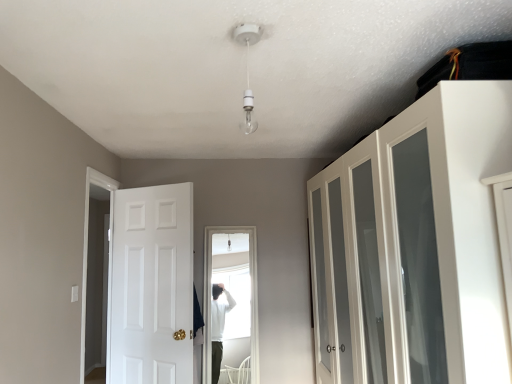
Measure the distance between white glossy door at left and camera.

white glossy door at left is 2.78 meters from camera.

What do you see at coordinates (151, 286) in the screenshot? Image resolution: width=512 pixels, height=384 pixels. I see `white glossy door at left` at bounding box center [151, 286].

Find the location of a particular element. The width and height of the screenshot is (512, 384). white glossy door at left is located at coordinates (151, 286).

What is the approximate width of white glass cabinet at upper right?

The width of white glass cabinet at upper right is 21.11 inches.

You are a GUI agent. You are given a task and a screenshot of the screen. Output one action in this format:
    pyautogui.click(x=<x>, y=<y>)
    Task: Click on the white glass cabinet at upper right
    The height and width of the screenshot is (384, 512).
    Given the screenshot: What is the action you would take?
    pyautogui.click(x=415, y=245)

Describe the element at coordinates (415, 245) in the screenshot. This screenshot has height=384, width=512. I see `white glass cabinet at upper right` at that location.

What are the coordinates of `white glossy door at left` in the screenshot? It's located at (151, 286).

Which object is positioned more to the left, white glossy door at left or white glass cabinet at upper right?

white glossy door at left.

Is the depth of white glossy door at left greater than that of white glass cabinet at upper right?

Yes, the depth of white glossy door at left is greater than that of white glass cabinet at upper right.

Does point (125, 245) come farther from viewer compared to point (434, 284)?

Yes, it is behind point (434, 284).

From the image's perspective, is white glossy door at left below white glass cabinet at upper right?

Yes, from the image's perspective, white glossy door at left is below white glass cabinet at upper right.

From a real-world perspective, is white glossy door at left physically located above or below white glass cabinet at upper right?

Clearly, from a real-world perspective, white glossy door at left is above white glass cabinet at upper right.

Looking at their sizes, would you say white glossy door at left is wider or thinner than white glass cabinet at upper right?

white glossy door at left is thinner than white glass cabinet at upper right.

From the picture: Can you confirm if white glossy door at left is shorter than white glass cabinet at upper right?

Yes.

Considering the relative sizes of white glossy door at left and white glass cabinet at upper right in the image provided, is white glossy door at left bigger than white glass cabinet at upper right?

No.

Is white glossy door at left surrounding white glass cabinet at upper right?

That's incorrect, white glass cabinet at upper right is not inside white glossy door at left.

Is white glossy door at left far from white glass cabinet at upper right?

Indeed, white glossy door at left is not near white glass cabinet at upper right.

Is white glossy door at left oriented towards white glass cabinet at upper right?

No, white glossy door at left is not aimed at white glass cabinet at upper right.

Image resolution: width=512 pixels, height=384 pixels. Identify the location of door located behind the white glass cabinet at upper right. (151, 286).

Does white glass cabinet at upper right appear on the right side of white glossy door at left?

Yes.

Relative to white glossy door at left, is white glass cabinet at upper right in front or behind?

Visually, white glass cabinet at upper right is located in front of white glossy door at left.

Is point (386, 326) farther from camera compared to point (133, 332)?

That is False.

Based on the photo, from the image's perspective, between white glass cabinet at upper right and white glossy door at left, which one is located above?

white glass cabinet at upper right is shown above in the image.

From a real-world perspective, relative to white glossy door at left, is white glass cabinet at upper right vertically above or below?

In terms of real-world spatial position, white glass cabinet at upper right is below white glossy door at left.

Considering the sizes of objects white glass cabinet at upper right and white glossy door at left in the image provided, who is wider, white glass cabinet at upper right or white glossy door at left?

Wider between the two is white glass cabinet at upper right.

Considering the sizes of objects white glass cabinet at upper right and white glossy door at left in the image provided, who is shorter, white glass cabinet at upper right or white glossy door at left?

white glossy door at left is shorter.

Considering the relative sizes of white glass cabinet at upper right and white glossy door at left in the image provided, is white glass cabinet at upper right bigger than white glossy door at left?

Indeed, white glass cabinet at upper right has a larger size compared to white glossy door at left.

Consider the image. Is white glass cabinet at upper right completely or partially outside of white glossy door at left?

Yes, white glass cabinet at upper right is located beyond the bounds of white glossy door at left.

Would you consider white glass cabinet at upper right to be distant from white glossy door at left?

Yes, white glass cabinet at upper right and white glossy door at left are quite far apart.

Is white glass cabinet at upper right facing away from white glossy door at left?

No, white glossy door at left is not at the back of white glass cabinet at upper right.

What's the angular difference between white glass cabinet at upper right and white glossy door at left's facing directions?

56.3 degrees.

Image resolution: width=512 pixels, height=384 pixels. In order to click on door behind the white glass cabinet at upper right in this screenshot , I will do `click(151, 286)`.

Identify the location of door that is on the left side of white glass cabinet at upper right. (151, 286).

Locate an element on the screen. This screenshot has width=512, height=384. cupboard located underneath the white glossy door at left (from a real-world perspective) is located at coordinates (415, 245).